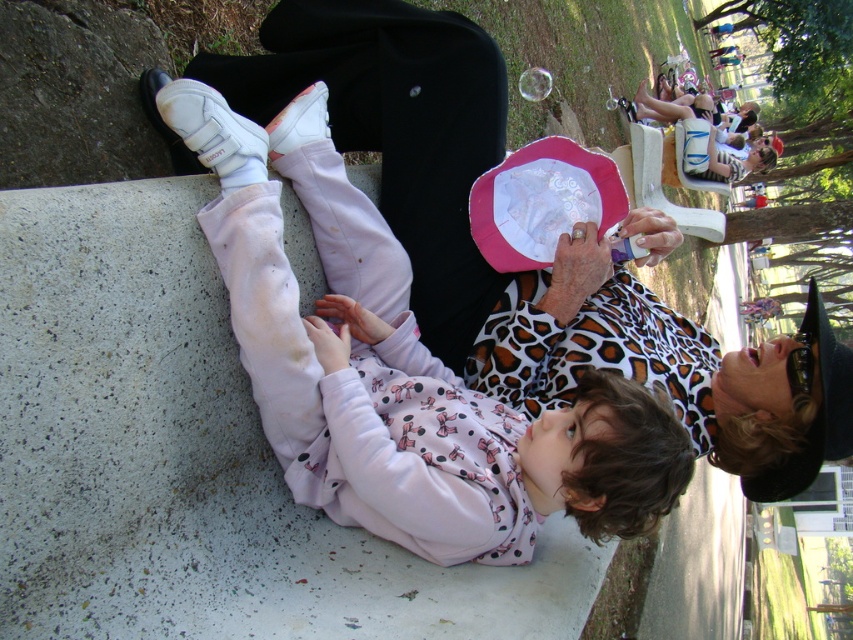
You are a parent looking for your child who is wearing a pink fleece sweatshirt at lower center and holding a pink fabric paper plate at center. Based on the scene, which item would you prioritize checking first to locate your child?

The pink fleece sweatshirt at lower center is larger in size than the pink fabric paper plate at center, so you should prioritize checking the pink fleece sweatshirt at lower center first as it is more visible due to its larger size.

You are a photographer trying to capture the pink fleece sweatshirt at lower center and the pink fabric paper plate at center in the same frame. Which object should you focus on first to ensure both fit in the photo?

The pink fleece sweatshirt at lower center is wider than the pink fabric paper plate at center, so you should focus on the pink fleece sweatshirt at lower center first to ensure both fit in the photo.

Looking at this image, you are a photographer trying to capture a closeup of the pink fabric paper plate at center. You notice the pink fleece sweatshirt at lower center is blocking part of the plate. Can you move the sweatshirt to the right to get a clearer shot?

The pink fleece sweatshirt at lower center is positioned on the left side of the pink fabric paper plate at center. Moving it to the right would allow the photographer to capture the plate without obstruction.